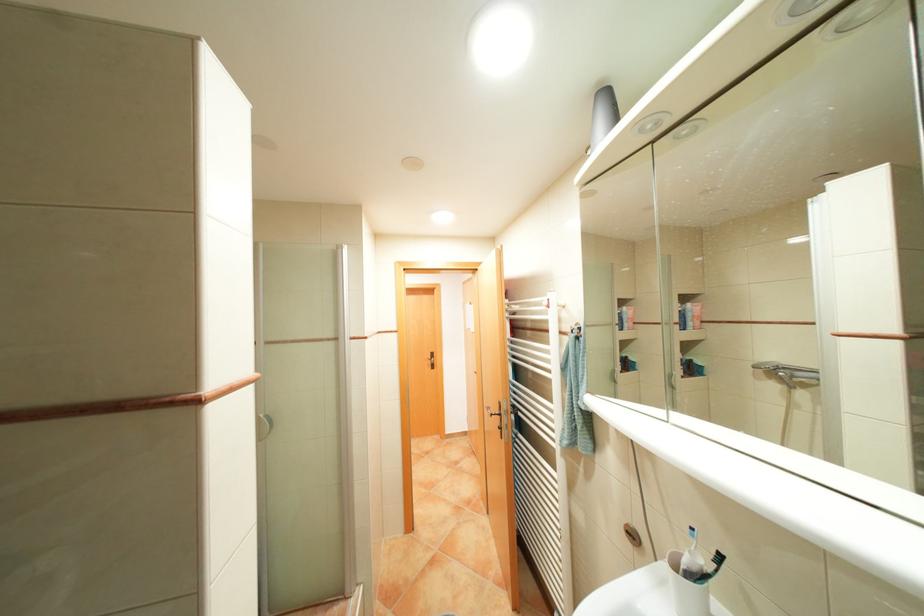
I want to click on metal door handle, so click(x=502, y=416).